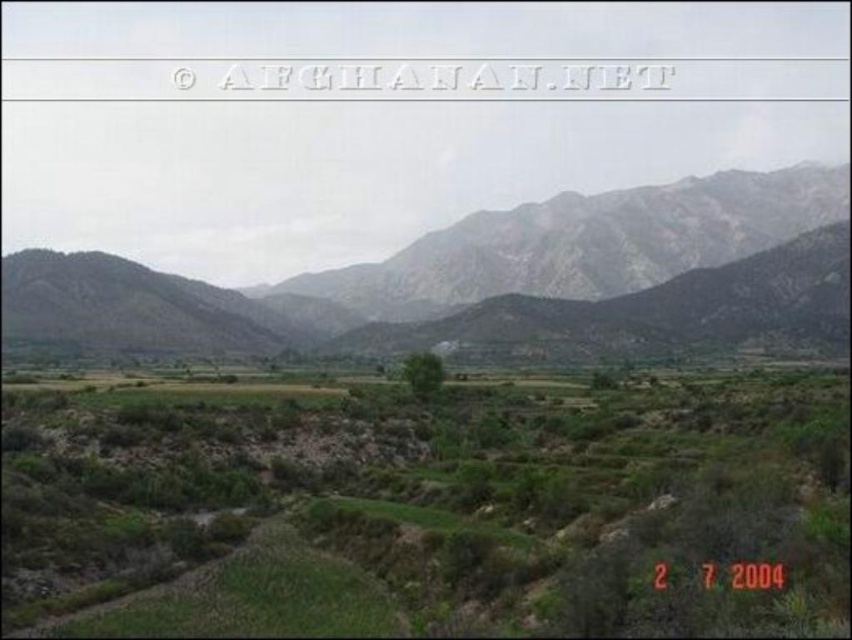
Looking at this image, you are planning to set up a temporary campsite in the image. You need to choose between the green grassy field at center and the rocky gray mountain range at upper center. Which location offers more horizontal space for setting up tents and equipment?

The rocky gray mountain range at upper center offers more horizontal space because its width is greater than the green grassy field at center.

You are standing on the green grassy field at center and want to reach the rocky gray mountain range at upper center. Which direction should you walk to get closer to the mountain range?

You should walk towards the upper center direction to get closer to the rocky gray mountain range at upper center since it is located behind the green grassy field at center.